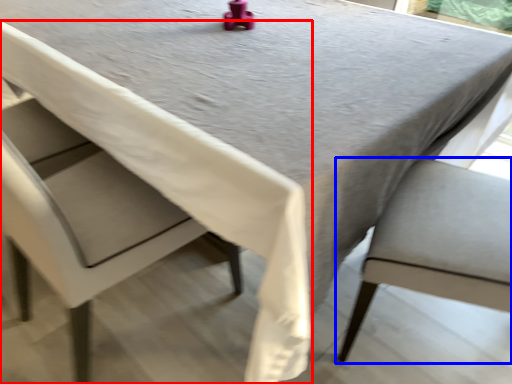
Question: Among these objects, which one is farthest to the camera, chair (highlighted by a red box) or chair (highlighted by a blue box)?

Choices:
 (A) chair
 (B) chair

Answer: (B)